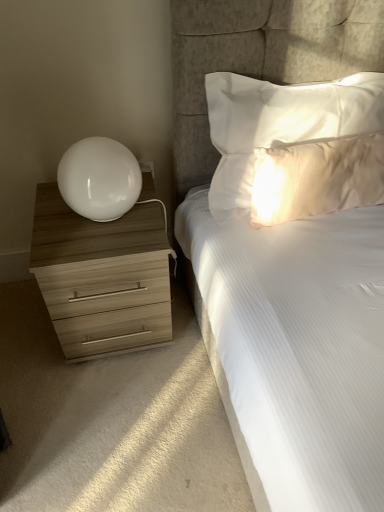
The height and width of the screenshot is (512, 384). What do you see at coordinates (102, 274) in the screenshot? I see `wooden chest of drawers at left` at bounding box center [102, 274].

At what (x,y) coordinates should I click in order to perform the action: click on wooden chest of drawers at left. Please return your answer as a coordinate pair (x, y). The height and width of the screenshot is (512, 384). Looking at the image, I should click on (102, 274).

Where is `white glossy table lamp at left`? white glossy table lamp at left is located at coordinates (99, 179).

Between white glossy table lamp at left and wooden chest of drawers at left, which one has larger width?

wooden chest of drawers at left.

Which is in front, point (71, 167) or point (40, 207)?

The point (71, 167) is more forward.

Which of these two, white glossy table lamp at left or wooden chest of drawers at left, stands taller?

wooden chest of drawers at left.

Where is `pillow behind the white glossy table lamp at left`? pillow behind the white glossy table lamp at left is located at coordinates (317, 178).

Does satin white pillow at upper right, which ranks as the 2th pillow in top-to-bottom order, turn towards white glossy table lamp at left?

No, satin white pillow at upper right, which ranks as the 2th pillow in top-to-bottom order, is not aimed at white glossy table lamp at left.

Is satin white pillow at upper right, which ranks as the 2th pillow in top-to-bottom order, positioned far away from white glossy table lamp at left?

That's not correct — satin white pillow at upper right, which ranks as the 2th pillow in top-to-bottom order, is a little close to white glossy table lamp at left.

Is white glossy table lamp at left facing towards satin white pillow at upper right, which ranks as the 2th pillow in top-to-bottom order?

No, white glossy table lamp at left does not turn towards satin white pillow at upper right, which ranks as the 2th pillow in top-to-bottom order.

Would you say satin white pillow at upper right, which ranks as the 2th pillow in top-to-bottom order, is part of white glossy table lamp at left's contents?

No, white glossy table lamp at left does not contain satin white pillow at upper right, which ranks as the 2th pillow in top-to-bottom order.

From the image's perspective, is white glossy table lamp at left above satin white pillow at upper right, which ranks as the first pillow in bottom-to-top order?

Actually, white glossy table lamp at left appears below satin white pillow at upper right, which ranks as the first pillow in bottom-to-top order, in the image.

How many degrees apart are the facing directions of white glossy table lamp at left and satin white pillow at upper right, which ranks as the first pillow in bottom-to-top order?

The angle between the facing direction of white glossy table lamp at left and the facing direction of satin white pillow at upper right, which ranks as the first pillow in bottom-to-top order, is 4.41 degrees.

Could you tell me if satin white pillow at upper right, which ranks as the first pillow in bottom-to-top order, is facing wooden chest of drawers at left?

No, satin white pillow at upper right, which ranks as the first pillow in bottom-to-top order, is not aimed at wooden chest of drawers at left.

Based on the photo, which object is wider, satin white pillow at upper right, which ranks as the first pillow in bottom-to-top order, or wooden chest of drawers at left?

wooden chest of drawers at left.

Is point (256, 195) closer or farther from the camera than point (156, 320)?

Point (256, 195) appears to be closer to the viewer than point (156, 320).

What's the angular difference between white satin pillow at upper right, the second pillow ordered from the bottom, and satin white pillow at upper right, which ranks as the first pillow in bottom-to-top order,'s facing directions?

There is a 0.00494-degree angle between the facing directions of white satin pillow at upper right, the second pillow ordered from the bottom, and satin white pillow at upper right, which ranks as the first pillow in bottom-to-top order.

Is white satin pillow at upper right, the second pillow ordered from the bottom, wider or thinner than satin white pillow at upper right, which ranks as the first pillow in bottom-to-top order?

In the image, white satin pillow at upper right, the second pillow ordered from the bottom, appears to be wider than satin white pillow at upper right, which ranks as the first pillow in bottom-to-top order.

The width and height of the screenshot is (384, 512). I want to click on pillow behind the white satin pillow at upper right, the first pillow in the top-to-bottom sequence, so click(x=317, y=178).

From a real-world perspective, is white satin pillow at upper right, the first pillow in the top-to-bottom sequence, positioned above or below wooden chest of drawers at left?

white satin pillow at upper right, the first pillow in the top-to-bottom sequence, is situated higher than wooden chest of drawers at left in the real world.

Between white satin pillow at upper right, the first pillow in the top-to-bottom sequence, and wooden chest of drawers at left, which one has smaller width?

Thinner between the two is white satin pillow at upper right, the first pillow in the top-to-bottom sequence.

Is white satin pillow at upper right, the second pillow ordered from the bottom, closer to the viewer compared to wooden chest of drawers at left?

Yes, it is in front of wooden chest of drawers at left.

From the image's perspective, is white satin pillow at upper right, the first pillow in the top-to-bottom sequence, located beneath white glossy table lamp at left?

No, from the image's perspective, white satin pillow at upper right, the first pillow in the top-to-bottom sequence, is not beneath white glossy table lamp at left.

From a real-world perspective, which is physically above, white satin pillow at upper right, the second pillow ordered from the bottom, or white glossy table lamp at left?

white satin pillow at upper right, the second pillow ordered from the bottom, is physically above.

Considering the positions of point (303, 106) and point (60, 165), is point (303, 106) closer or farther from the camera than point (60, 165)?

Point (303, 106) is farther from the camera than point (60, 165).

Is white satin pillow at upper right, the first pillow in the top-to-bottom sequence, oriented towards white glossy table lamp at left?

No, white satin pillow at upper right, the first pillow in the top-to-bottom sequence, is not aimed at white glossy table lamp at left.

Identify the location of table lamp in front of the wooden chest of drawers at left. The image size is (384, 512). (99, 179).

Find the location of `the 1st pillow above the white glossy table lamp at left (from the image's perspective)`. the 1st pillow above the white glossy table lamp at left (from the image's perspective) is located at coordinates (317, 178).

From the image, which object appears to be farther from wooden chest of drawers at left, white satin pillow at upper right, the first pillow in the top-to-bottom sequence, or white glossy table lamp at left?

The object further to wooden chest of drawers at left is white satin pillow at upper right, the first pillow in the top-to-bottom sequence.

Looking at the image, which one is located further to satin white pillow at upper right, which ranks as the 2th pillow in top-to-bottom order, white glossy table lamp at left or white satin pillow at upper right, the first pillow in the top-to-bottom sequence?

Among the two, white glossy table lamp at left is located further to satin white pillow at upper right, which ranks as the 2th pillow in top-to-bottom order.

Estimate the real-world distances between objects in this image. Which object is closer to white glossy table lamp at left, satin white pillow at upper right, which ranks as the 2th pillow in top-to-bottom order, or white satin pillow at upper right, the second pillow ordered from the bottom?

white satin pillow at upper right, the second pillow ordered from the bottom.

Based on their spatial positions, is wooden chest of drawers at left or satin white pillow at upper right, which ranks as the 2th pillow in top-to-bottom order, closer to white glossy table lamp at left?

The object closer to white glossy table lamp at left is wooden chest of drawers at left.

Looking at this image, when comparing their distances from white satin pillow at upper right, the first pillow in the top-to-bottom sequence, does wooden chest of drawers at left or white glossy table lamp at left seem further?

Among the two, wooden chest of drawers at left is located further to white satin pillow at upper right, the first pillow in the top-to-bottom sequence.

When comparing their distances from white satin pillow at upper right, the first pillow in the top-to-bottom sequence, does white glossy table lamp at left or satin white pillow at upper right, which ranks as the first pillow in bottom-to-top order, seem closer?

Among the two, satin white pillow at upper right, which ranks as the first pillow in bottom-to-top order, is located nearer to white satin pillow at upper right, the first pillow in the top-to-bottom sequence.

Based on the photo, estimate the real-world distances between objects in this image. Which object is further from wooden chest of drawers at left, white satin pillow at upper right, the first pillow in the top-to-bottom sequence, or satin white pillow at upper right, which ranks as the first pillow in bottom-to-top order?

satin white pillow at upper right, which ranks as the first pillow in bottom-to-top order, is further to wooden chest of drawers at left.

When comparing their distances from satin white pillow at upper right, which ranks as the 2th pillow in top-to-bottom order, does wooden chest of drawers at left or white satin pillow at upper right, the first pillow in the top-to-bottom sequence, seem further?

wooden chest of drawers at left is further to satin white pillow at upper right, which ranks as the 2th pillow in top-to-bottom order.

This screenshot has height=512, width=384. In order to click on pillow located between white glossy table lamp at left and satin white pillow at upper right, which ranks as the first pillow in bottom-to-top order, in the left-right direction in this screenshot , I will do (280, 124).

This screenshot has height=512, width=384. Find the location of `table lamp between wooden chest of drawers at left and satin white pillow at upper right, which ranks as the 2th pillow in top-to-bottom order`. table lamp between wooden chest of drawers at left and satin white pillow at upper right, which ranks as the 2th pillow in top-to-bottom order is located at coordinates (99, 179).

In order to click on table lamp between wooden chest of drawers at left and white satin pillow at upper right, the first pillow in the top-to-bottom sequence in this screenshot , I will do `click(99, 179)`.

Locate an element on the screen. pillow situated between wooden chest of drawers at left and satin white pillow at upper right, which ranks as the first pillow in bottom-to-top order, from left to right is located at coordinates (280, 124).